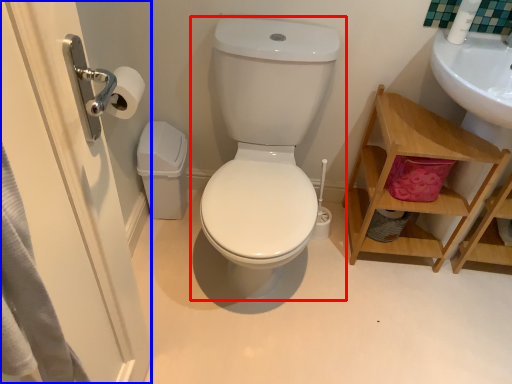
Question: Which point is closer to the camera, toilet (highlighted by a red box) or screen door (highlighted by a blue box)?

Choices:
 (A) toilet
 (B) screen door

Answer: (B)